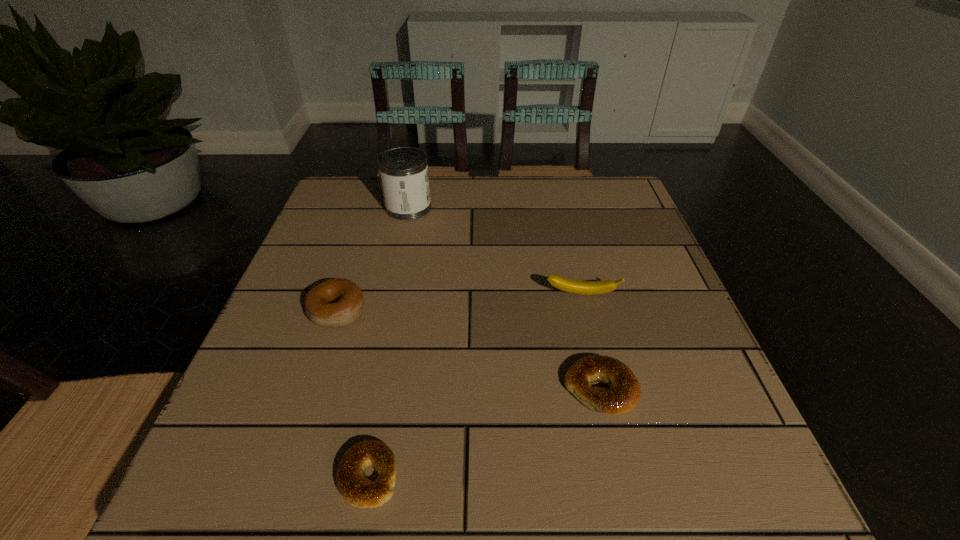
Image resolution: width=960 pixels, height=540 pixels. In order to click on vacant space in between the tallest object and the tallest bagel in this screenshot , I will do `click(372, 260)`.

I want to click on vacant area between the banana and the tallest object, so click(495, 251).

This screenshot has height=540, width=960. In order to click on unoccupied area between the second bagel from right to left and the tallest object in this screenshot , I will do `click(388, 341)`.

This screenshot has width=960, height=540. I want to click on free space between the tallest bagel and the banana, so click(x=459, y=303).

Locate an element on the screen. free space between the shortest object and the can is located at coordinates (388, 341).

This screenshot has height=540, width=960. What are the coordinates of `free space that is in between the leftmost bagel and the tallest object` in the screenshot? It's located at (372, 260).

Find the location of a particular element. The height and width of the screenshot is (540, 960). vacant area that lies between the banana and the can is located at coordinates (495, 251).

Find the location of a particular element. Image resolution: width=960 pixels, height=540 pixels. vacant point located between the shortest bagel and the farthest bagel is located at coordinates (352, 394).

The height and width of the screenshot is (540, 960). Find the location of `object that can be found as the second closest to the fourth tallest object`. object that can be found as the second closest to the fourth tallest object is located at coordinates (356, 489).

Locate an element on the screen. This screenshot has width=960, height=540. object that ranks as the third closest to the farthest bagel is located at coordinates (572, 286).